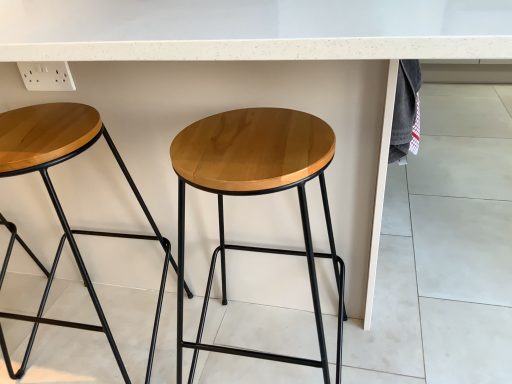
In order to face natural wood stool at center, which is the first stool from right to left, should I rotate leftwards or rightwards?

Rotate right and turn 0.600 degrees.

Image resolution: width=512 pixels, height=384 pixels. Describe the element at coordinates (256, 194) in the screenshot. I see `natural wood stool at center, which ranks as the 2th stool in left-to-right order` at that location.

The image size is (512, 384). Find the location of `natural wood stool at center, which is the first stool from right to left`. natural wood stool at center, which is the first stool from right to left is located at coordinates click(256, 194).

This screenshot has width=512, height=384. What are the coordinates of `wooden seat stool at center, the first stool from the left` in the screenshot? It's located at (59, 202).

This screenshot has height=384, width=512. What do you see at coordinates (59, 202) in the screenshot?
I see `wooden seat stool at center, marked as the second stool in a right-to-left arrangement` at bounding box center [59, 202].

Locate an element on the screen. The width and height of the screenshot is (512, 384). natural wood stool at center, which ranks as the 2th stool in left-to-right order is located at coordinates (256, 194).

Visually, is natural wood stool at center, which ranks as the 2th stool in left-to-right order, positioned to the left or to the right of wooden seat stool at center, marked as the second stool in a right-to-left arrangement?

natural wood stool at center, which ranks as the 2th stool in left-to-right order, is to the right of wooden seat stool at center, marked as the second stool in a right-to-left arrangement.

Is the position of natural wood stool at center, which ranks as the 2th stool in left-to-right order, more distant than that of wooden seat stool at center, marked as the second stool in a right-to-left arrangement?

No, natural wood stool at center, which ranks as the 2th stool in left-to-right order, is closer to the viewer.

Does point (200, 156) come farther from viewer compared to point (155, 236)?

No, (200, 156) is in front of (155, 236).

From the image's perspective, does natural wood stool at center, which is the first stool from right to left, appear lower than wooden seat stool at center, the first stool from the left?

Correct, natural wood stool at center, which is the first stool from right to left, appears lower than wooden seat stool at center, the first stool from the left, in the image.

From the picture: From a real-world perspective, between natural wood stool at center, which ranks as the 2th stool in left-to-right order, and wooden seat stool at center, the first stool from the left, who is vertically higher?

natural wood stool at center, which ranks as the 2th stool in left-to-right order, from a real-world perspective.

Looking at their sizes, would you say natural wood stool at center, which ranks as the 2th stool in left-to-right order, is wider or thinner than wooden seat stool at center, marked as the second stool in a right-to-left arrangement?

In the image, natural wood stool at center, which ranks as the 2th stool in left-to-right order, appears to be wider than wooden seat stool at center, marked as the second stool in a right-to-left arrangement.

Can you confirm if natural wood stool at center, which ranks as the 2th stool in left-to-right order, is taller than wooden seat stool at center, the first stool from the left?

No.

Considering the relative sizes of natural wood stool at center, which is the first stool from right to left, and wooden seat stool at center, marked as the second stool in a right-to-left arrangement, in the image provided, is natural wood stool at center, which is the first stool from right to left, bigger than wooden seat stool at center, marked as the second stool in a right-to-left arrangement,?

Correct, natural wood stool at center, which is the first stool from right to left, is larger in size than wooden seat stool at center, marked as the second stool in a right-to-left arrangement.

Consider the image. Would you say natural wood stool at center, which is the first stool from right to left, contains wooden seat stool at center, marked as the second stool in a right-to-left arrangement?

No, natural wood stool at center, which is the first stool from right to left, does not contain wooden seat stool at center, marked as the second stool in a right-to-left arrangement.

Is natural wood stool at center, which is the first stool from right to left, placed right next to wooden seat stool at center, the first stool from the left?

natural wood stool at center, which is the first stool from right to left, and wooden seat stool at center, the first stool from the left, are not in contact.

Is natural wood stool at center, which ranks as the 2th stool in left-to-right order, facing away from wooden seat stool at center, the first stool from the left?

No.

Can you tell me how much natural wood stool at center, which ranks as the 2th stool in left-to-right order, and wooden seat stool at center, the first stool from the left, differ in facing direction?

0.000127 degrees.

Locate an element on the screen. This screenshot has height=384, width=512. stool located underneath the natural wood stool at center, which is the first stool from right to left (from a real-world perspective) is located at coordinates (59, 202).

Which object is positioned more to the left, wooden seat stool at center, marked as the second stool in a right-to-left arrangement, or natural wood stool at center, which ranks as the 2th stool in left-to-right order?

Positioned to the left is wooden seat stool at center, marked as the second stool in a right-to-left arrangement.

Is wooden seat stool at center, marked as the second stool in a right-to-left arrangement, further to the viewer compared to natural wood stool at center, which is the first stool from right to left?

That is True.

Which is closer to the camera, [126,175] or [203,305]?

The point [126,175] is in front.

From the image's perspective, between wooden seat stool at center, the first stool from the left, and natural wood stool at center, which is the first stool from right to left, which one is located above?

wooden seat stool at center, the first stool from the left.

From a real-world perspective, which object stands above the other?

natural wood stool at center, which is the first stool from right to left, from a real-world perspective.

Which object is wider, wooden seat stool at center, marked as the second stool in a right-to-left arrangement, or natural wood stool at center, which ranks as the 2th stool in left-to-right order?

With larger width is natural wood stool at center, which ranks as the 2th stool in left-to-right order.

Is wooden seat stool at center, the first stool from the left, taller than natural wood stool at center, which is the first stool from right to left?

No.

In terms of size, does wooden seat stool at center, marked as the second stool in a right-to-left arrangement, appear bigger or smaller than natural wood stool at center, which ranks as the 2th stool in left-to-right order?

In the image, wooden seat stool at center, marked as the second stool in a right-to-left arrangement, appears to be smaller than natural wood stool at center, which ranks as the 2th stool in left-to-right order.

Would you say wooden seat stool at center, the first stool from the left, is inside or outside natural wood stool at center, which ranks as the 2th stool in left-to-right order?

wooden seat stool at center, the first stool from the left, is spatially situated outside natural wood stool at center, which ranks as the 2th stool in left-to-right order.

Are wooden seat stool at center, the first stool from the left, and natural wood stool at center, which ranks as the 2th stool in left-to-right order, making contact?

wooden seat stool at center, the first stool from the left, is not next to natural wood stool at center, which ranks as the 2th stool in left-to-right order, and they're not touching.

Is wooden seat stool at center, marked as the second stool in a right-to-left arrangement, turned away from natural wood stool at center, which is the first stool from right to left?

No, wooden seat stool at center, marked as the second stool in a right-to-left arrangement,'s orientation is not away from natural wood stool at center, which is the first stool from right to left.

How many degrees apart are the facing directions of wooden seat stool at center, marked as the second stool in a right-to-left arrangement, and natural wood stool at center, which is the first stool from right to left?

The facing directions of wooden seat stool at center, marked as the second stool in a right-to-left arrangement, and natural wood stool at center, which is the first stool from right to left, are 0.000127 degrees apart.

Locate an element on the screen. The height and width of the screenshot is (384, 512). stool below the natural wood stool at center, which is the first stool from right to left (from a real-world perspective) is located at coordinates (59, 202).

Locate an element on the screen. The width and height of the screenshot is (512, 384). stool that is on the right side of wooden seat stool at center, marked as the second stool in a right-to-left arrangement is located at coordinates click(x=256, y=194).

In order to click on stool in front of the wooden seat stool at center, the first stool from the left in this screenshot , I will do `click(256, 194)`.